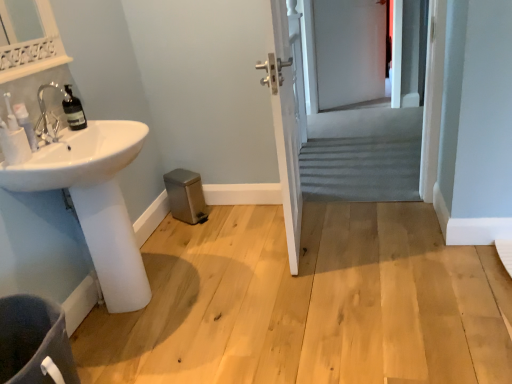
Identify the location of vacant area that lies to the right of white glossy sink at lower left. The width and height of the screenshot is (512, 384). (230, 288).